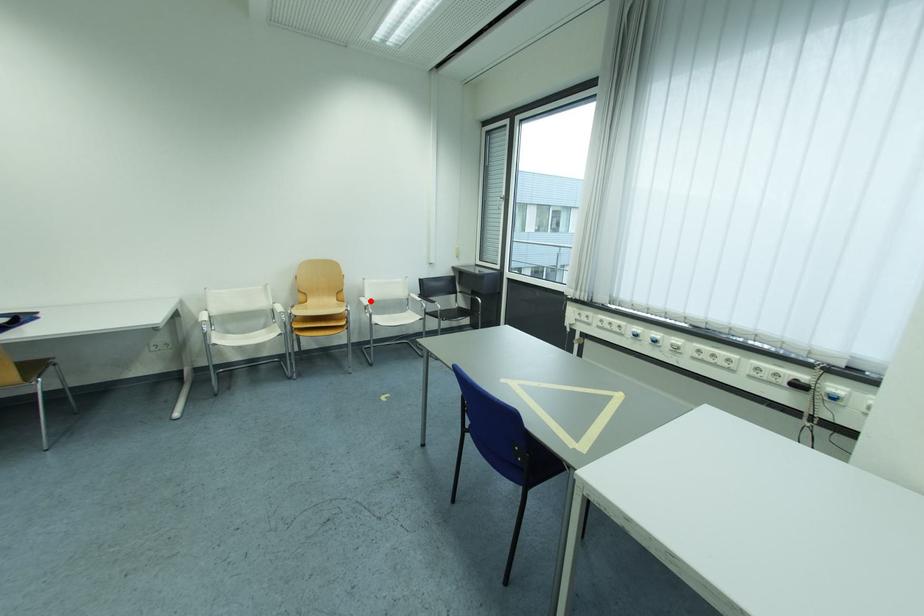
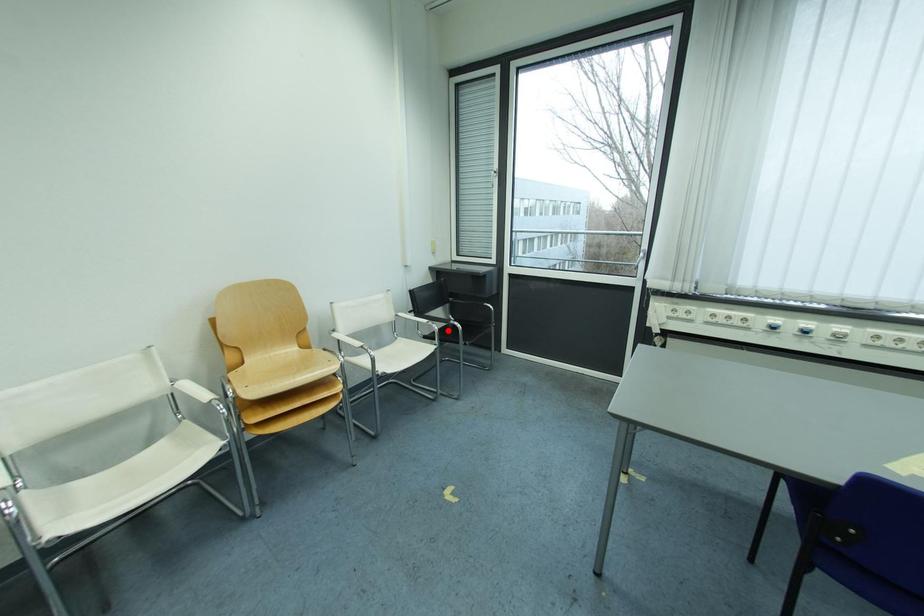
I am providing you with two images of the same scene from different viewpoints. A red point is marked on the first image and another point is marked on the second image. Do the highlighted points in image1 and image2 indicate the same real-world spot?

No